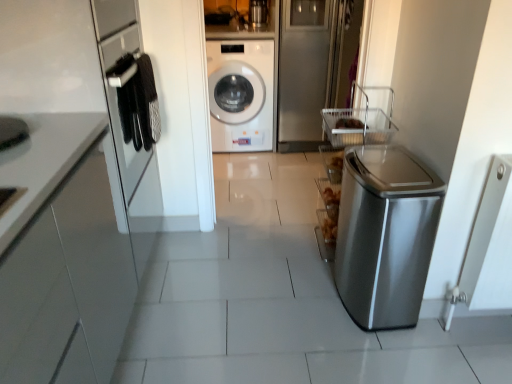
I want to click on free space on the front side of satin silver trash can at right, so click(387, 352).